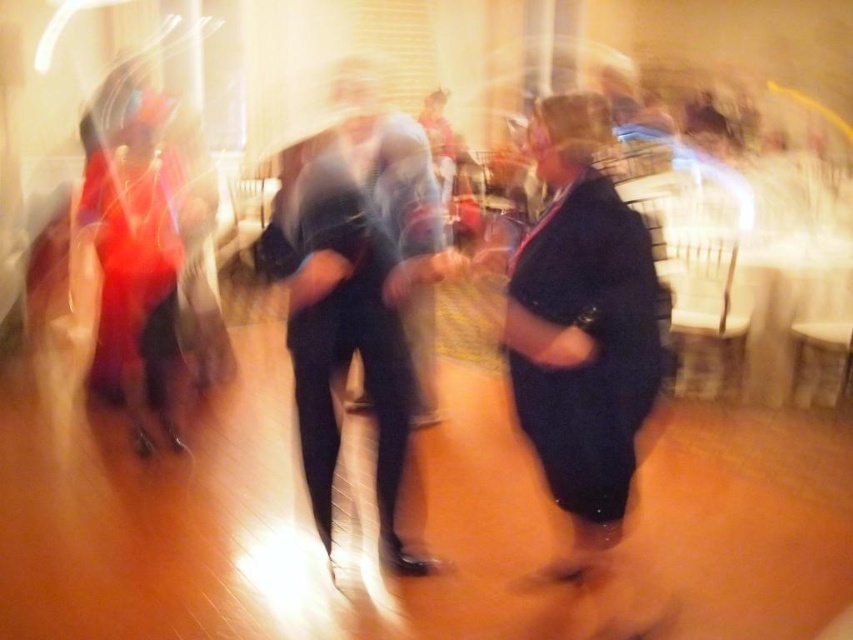
You are standing in the middle of the room and see two points in the image, point (318, 252) and point (541, 426). Which point is closer to you?

Point (318, 252) is closer to you than point (541, 426).

In the scene shown: You are a photographer at a wedding reception. You need to capture a clear photo of the matte black suit at center and dark blue jeans at center. The camera requires the subjects to be at least 1 meter apart to avoid blurring. Based on the scene description, can you take a clear photo of both subjects without them overlapping?

The distance between the matte black suit at center and dark blue jeans at center is 60.37 centimeters. Since this distance is less than the required 1 meter, the camera cannot capture a clear photo without blurring or overlapping.

You are at a wedding reception and want to find the matte black suit at center and dark blue jeans at center. Based on their positions, which one is closer to the left side of the image?

The matte black suit at center is to the left of dark blue jeans at center, so the matte black suit at center is closer to the left side of the image.